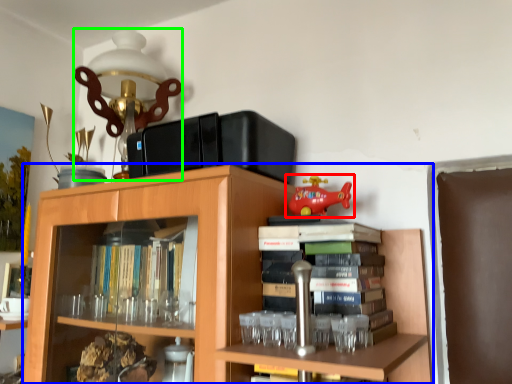
Question: Which is farther away from toy (highlighted by a red box)? bookcase (highlighted by a blue box) or table lamp (highlighted by a green box)?

Choices:
 (A) bookcase
 (B) table lamp

Answer: (B)